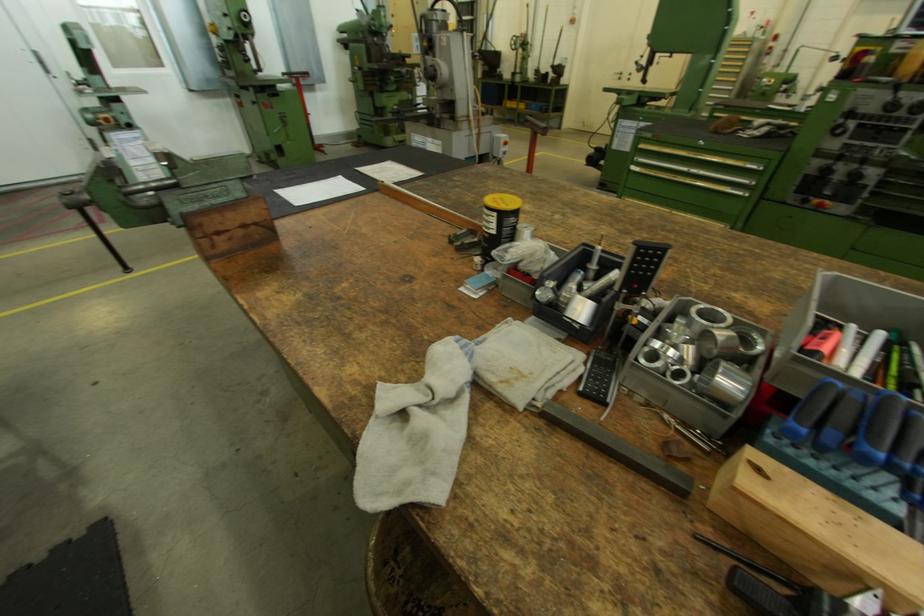
Identify the location of red T-handle. pyautogui.click(x=304, y=103).